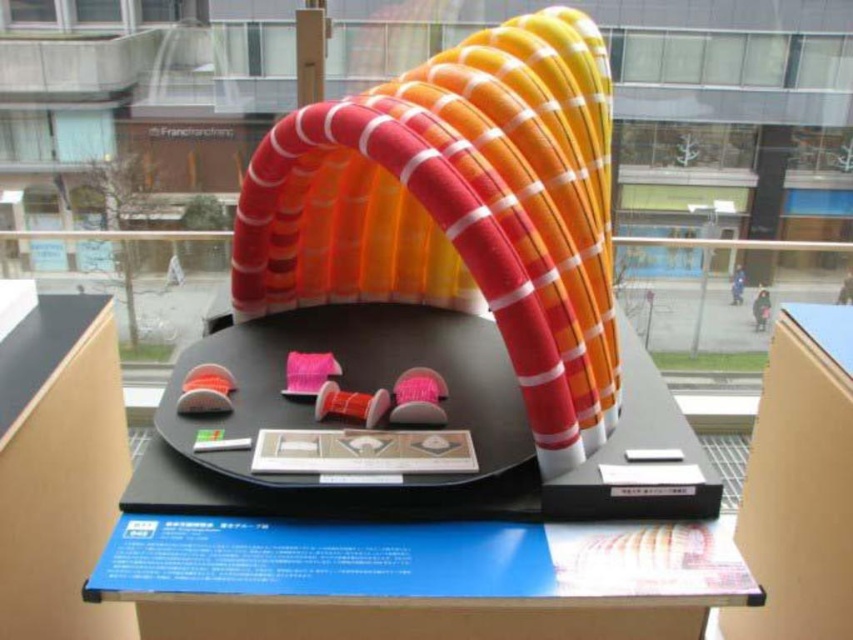
You are an artist planning to place a small sculpture on the display platform. The sculpture requires a base that is at least 10 cm in height. Given the pink fuzzy ball at center and the pink fabric spool at center, which object would be suitable as a base?

The pink fuzzy ball at center is much taller than the pink fabric spool at center, so it would be suitable as a base for the sculpture since it meets the height requirement.

You are an artist planning to place a small sculpture that is 10 cm in diameter on the black circular platform. The platform has the pink fuzzy ball at center and the pink fabric spool at center. Can the sculpture fit on the platform without overlapping either object?

The pink fuzzy ball at center is bigger than the pink fabric spool at center. Since the sculpture is only 10 cm in diameter, it can be placed on the platform as long as it doesn not overlap the larger pink fuzzy ball at center or the smaller pink fabric spool at center.

You are an event organizer setting up a booth. You have a black matte table at center and a matte plastic spool at center. Which object should you place a heavy decorative item on to ensure stability?

The black matte table at center has a larger size compared to the matte plastic spool at center, so placing the heavy decorative item on the black matte table at center would provide better stability due to its larger surface area.